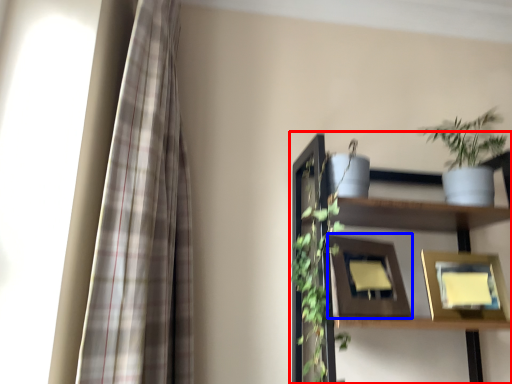
Question: Which of the following is the closest to the observer, shelf (highlighted by a red box) or picture frame (highlighted by a blue box)?

Choices:
 (A) shelf
 (B) picture frame

Answer: (A)